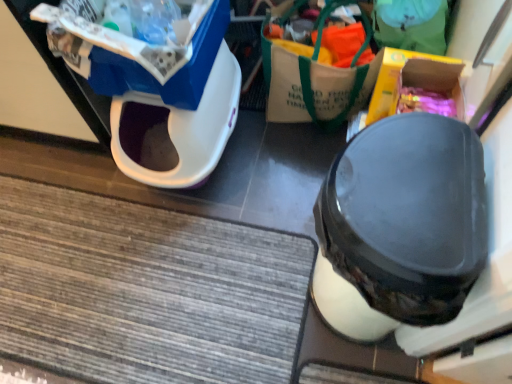
Question: Considering the relative sizes of white canvas tote bag at upper center and blue plastic storage box at upper left, the second storage box from the right, in the image provided, is white canvas tote bag at upper center bigger than blue plastic storage box at upper left, the second storage box from the right,?

Choices:
 (A) yes
 (B) no

Answer: (A)

Question: From the image's perspective, is white canvas tote bag at upper center under blue plastic storage box at upper left, the second storage box from the right?

Choices:
 (A) no
 (B) yes

Answer: (B)

Question: From a real-world perspective, is white canvas tote bag at upper center physically below blue plastic storage box at upper left, the second storage box from the right?

Choices:
 (A) yes
 (B) no

Answer: (A)

Question: Is white canvas tote bag at upper center further to the viewer compared to blue plastic storage box at upper left, the second storage box from the right?

Choices:
 (A) no
 (B) yes

Answer: (B)

Question: From a real-world perspective, is white canvas tote bag at upper center physically above blue plastic storage box at upper left, the second storage box from the right?

Choices:
 (A) yes
 (B) no

Answer: (B)

Question: Considering the relative sizes of white canvas tote bag at upper center and blue plastic storage box at upper left, the second storage box from the right, in the image provided, is white canvas tote bag at upper center wider than blue plastic storage box at upper left, the second storage box from the right,?

Choices:
 (A) no
 (B) yes

Answer: (A)

Question: Is blue plastic storage box at upper left, the second storage box from the right, positioned before black matte shoe at center?

Choices:
 (A) no
 (B) yes

Answer: (A)

Question: Would you say black matte shoe at center is part of blue plastic storage box at upper left, placed as the 1th storage box when sorted from left to right,'s contents?

Choices:
 (A) yes
 (B) no

Answer: (B)

Question: Is there a large distance between blue plastic storage box at upper left, placed as the 1th storage box when sorted from left to right, and black matte shoe at center?

Choices:
 (A) no
 (B) yes

Answer: (A)

Question: Considering the relative sizes of blue plastic storage box at upper left, the second storage box from the right, and black matte shoe at center in the image provided, is blue plastic storage box at upper left, the second storage box from the right, bigger than black matte shoe at center?

Choices:
 (A) no
 (B) yes

Answer: (A)

Question: Are blue plastic storage box at upper left, placed as the 1th storage box when sorted from left to right, and black matte shoe at center beside each other?

Choices:
 (A) yes
 (B) no

Answer: (B)

Question: Is blue plastic storage box at upper left, placed as the 1th storage box when sorted from left to right, completely or partially outside of black matte shoe at center?

Choices:
 (A) no
 (B) yes

Answer: (B)

Question: Considering the relative sizes of yellow cardboard box at upper right, the 2th storage box when ordered from left to right, and white plastic litter bin at upper left in the image provided, is yellow cardboard box at upper right, the 2th storage box when ordered from left to right, smaller than white plastic litter bin at upper left?

Choices:
 (A) yes
 (B) no

Answer: (A)